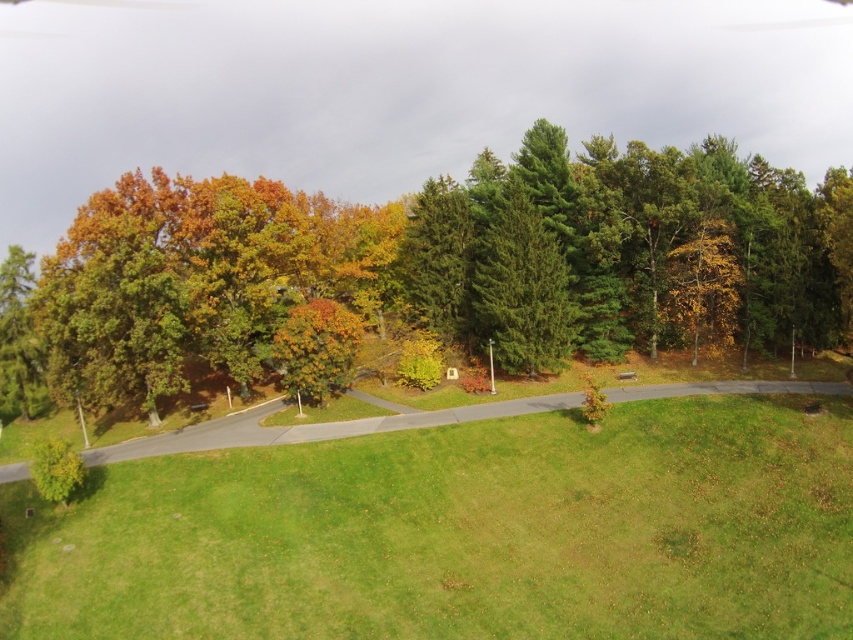
Question: Can you confirm if green grassy field at center is thinner than green matte tree at center?

Choices:
 (A) no
 (B) yes

Answer: (B)

Question: Which object appears farthest from the camera in this image?

Choices:
 (A) green grassy field at center
 (B) green matte tree at center

Answer: (B)

Question: Which point appears farthest from the camera in this image?

Choices:
 (A) (830, 419)
 (B) (525, 278)

Answer: (B)

Question: Is green grassy field at center positioned in front of green matte tree at center?

Choices:
 (A) no
 (B) yes

Answer: (B)

Question: Which object is closer to the camera taking this photo?

Choices:
 (A) green matte tree at center
 (B) green grassy field at center

Answer: (B)

Question: Does green grassy field at center appear on the left side of green matte tree at center?

Choices:
 (A) yes
 (B) no

Answer: (B)